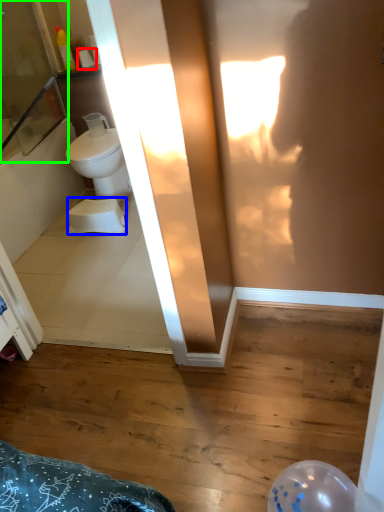
Question: Which object is the closest to the toilet paper (highlighted by a red box)? Choose among these: toilet bowl (highlighted by a blue box) or screen door (highlighted by a green box).

Choices:
 (A) toilet bowl
 (B) screen door

Answer: (B)